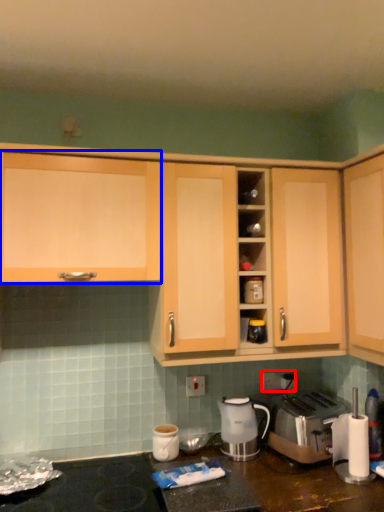
Question: Which point is closer to the camera, electric outlet (highlighted by a red box) or cabinetry (highlighted by a blue box)?

Choices:
 (A) electric outlet
 (B) cabinetry

Answer: (B)